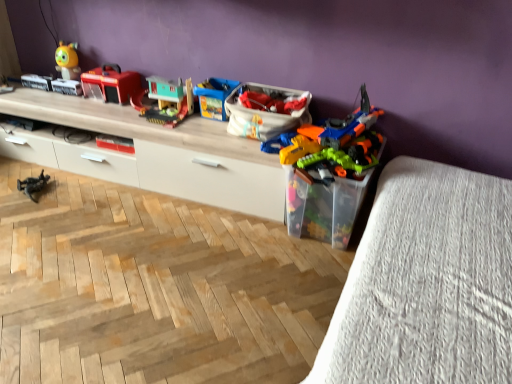
Locate an element on the screen. This screenshot has width=512, height=384. free space in front of metallic gray toy soldier at lower left, the fifth toy in the right-to-left sequence is located at coordinates (26, 208).